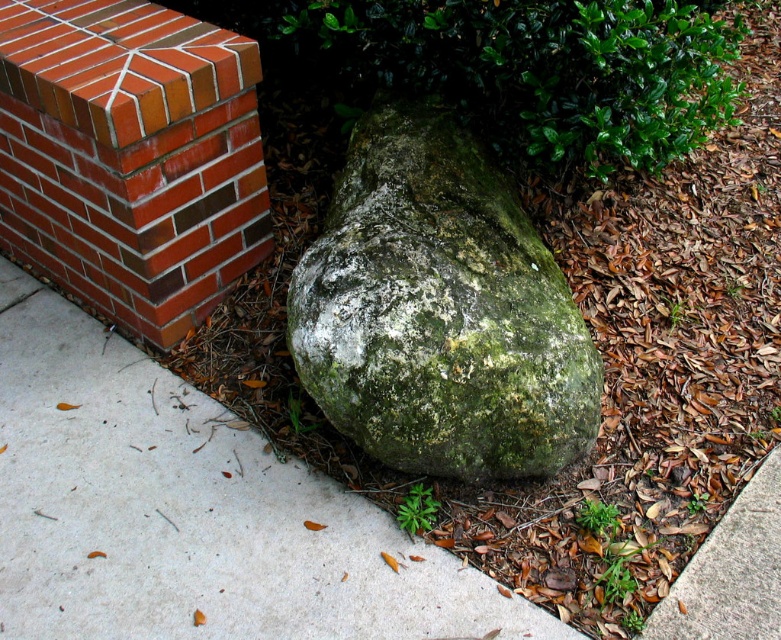
You are a delivery person trying to park your bike. The bike requires a space wider than the red brick at upper left. Is there enough space on the gray concrete pavement at center?

The gray concrete pavement at center is wider than the red brick at upper left, so yes, there is enough space to park the bike there.

In the scene shown: You are a delivery robot with a 17 inch wide package. You need to move from the gray concrete pavement at center to the red brick at upper left. Can you fit through the space between them without tilting the package?

The gray concrete pavement at center is 16.98 inches away from the red brick at upper left. Since the distance is slightly less than the 17 inch wide package, the robot cannot fit through the space between them without tilting the package.